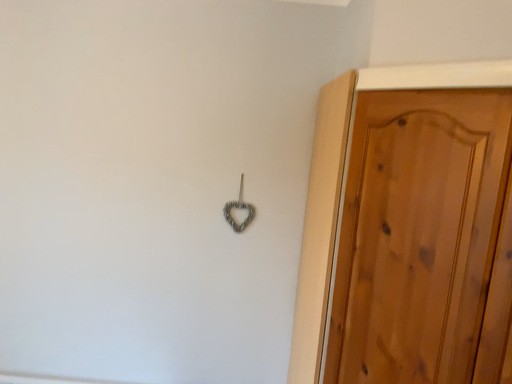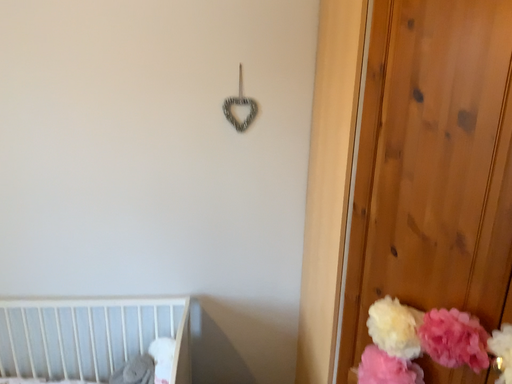
Question: How did the camera likely rotate when shooting the video?

Choices:
 (A) rotated downward
 (B) rotated upward

Answer: (A)